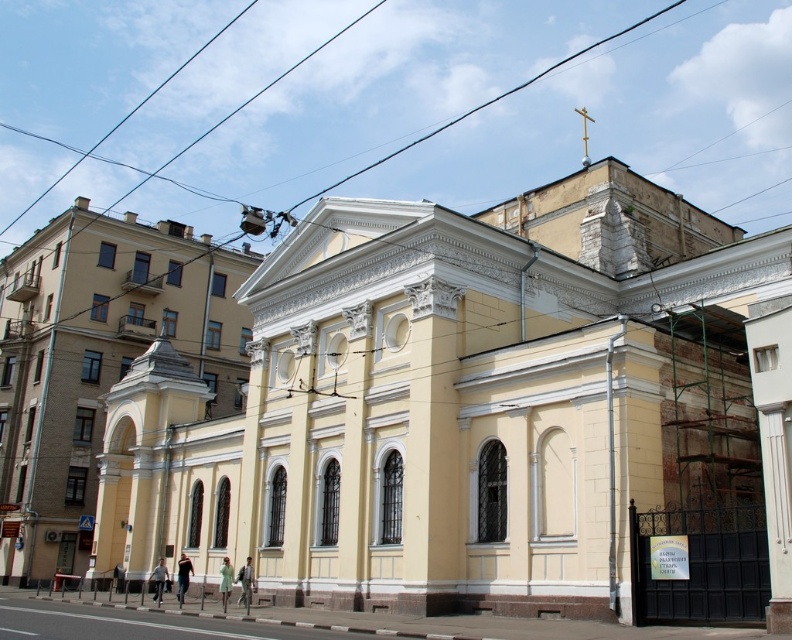
You are standing at the entrance of a park and want to take a photo of the yellow matte church at center. If your camera can focus on objects up to 30 meters away, will you be able to capture a clear image of the church?

The yellow matte church at center and camera are 32.37 meters apart from each other. Since the camera can only focus up to 30 meters, the distance is too far to capture a clear image of the yellow matte church at center.

You are standing at the entrance of the yellow matte church at center. If you walk straight ahead, will you exit the building through the main entrance or enter a different area?

Since the yellow matte church at center is located at point 0.612 on the y axis, walking straight ahead from the entrance would lead you out of the building through the main entrance.

You are standing in front of the classical building and want to take a photo of the yellow matte church at center and the yellow smooth church at center. Which one will appear larger in your photo?

The yellow matte church at center will appear larger in the photo because it is closer to the viewer than the yellow smooth church at center.